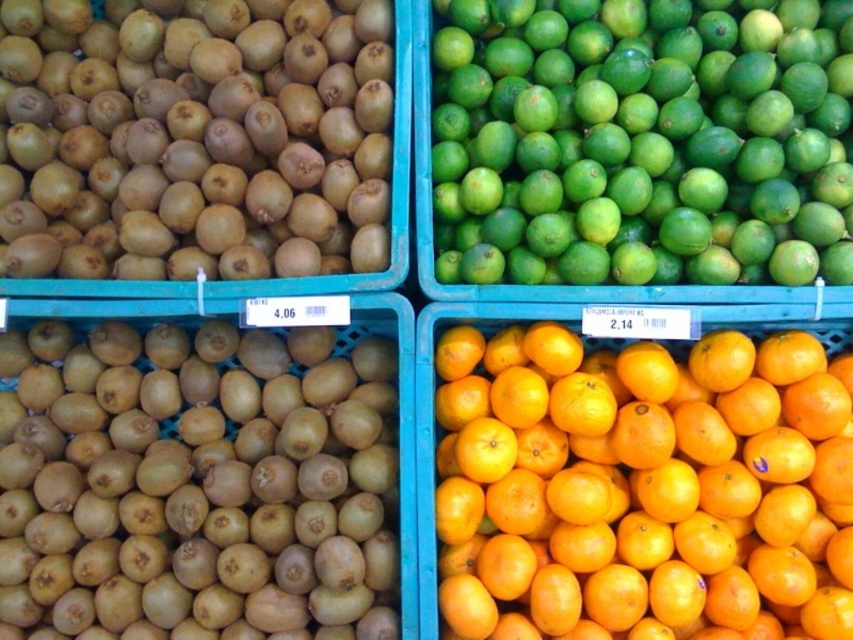
Consider the image. You are a customer at the market and want to buy a fruit that is wider than the other. You can choose between the green matte lime at upper right and the brown matte kiwi at upper left. Which one should you choose?

The green matte lime at upper right has a larger width than the brown matte kiwi at upper left, so you should choose the green matte lime at upper right.